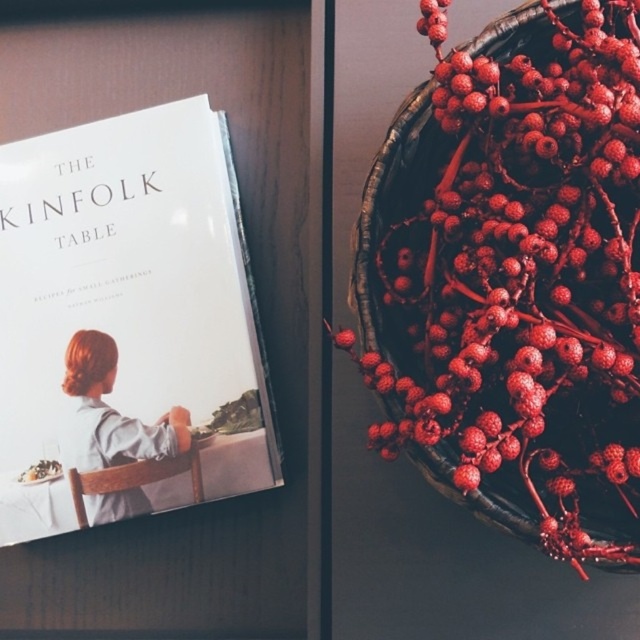
Question: Can you confirm if shiny red berries at upper right is thinner than white matte book at upper left?

Choices:
 (A) yes
 (B) no

Answer: (A)

Question: Which point is farther from the camera taking this photo?

Choices:
 (A) (48, 460)
 (B) (486, 164)
 (C) (93, 346)

Answer: (C)

Question: Can you confirm if shiny red berries at upper right is positioned to the right of white matte book at upper left?

Choices:
 (A) no
 (B) yes

Answer: (B)

Question: Among these objects, which one is nearest to the camera?

Choices:
 (A) matte gray dress at center
 (B) white matte book at upper left
 (C) shiny red berries at upper right

Answer: (C)

Question: Which point is closer to the camera taking this photo?

Choices:
 (A) (595, 253)
 (B) (99, 205)

Answer: (A)

Question: Is white matte book at upper left closer to the viewer compared to matte gray dress at center?

Choices:
 (A) no
 (B) yes

Answer: (B)